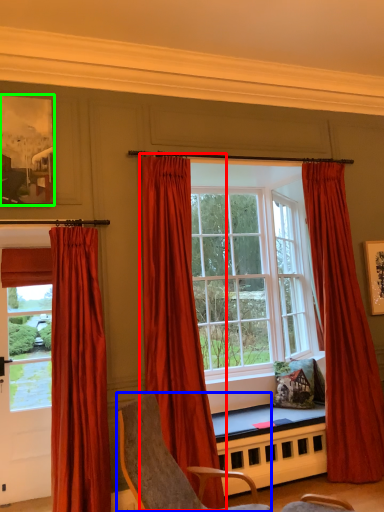
Question: Considering the real-world distances, which object is closest to curtain (highlighted by a red box)? chair (highlighted by a blue box) or picture frame (highlighted by a green box).

Choices:
 (A) chair
 (B) picture frame

Answer: (A)